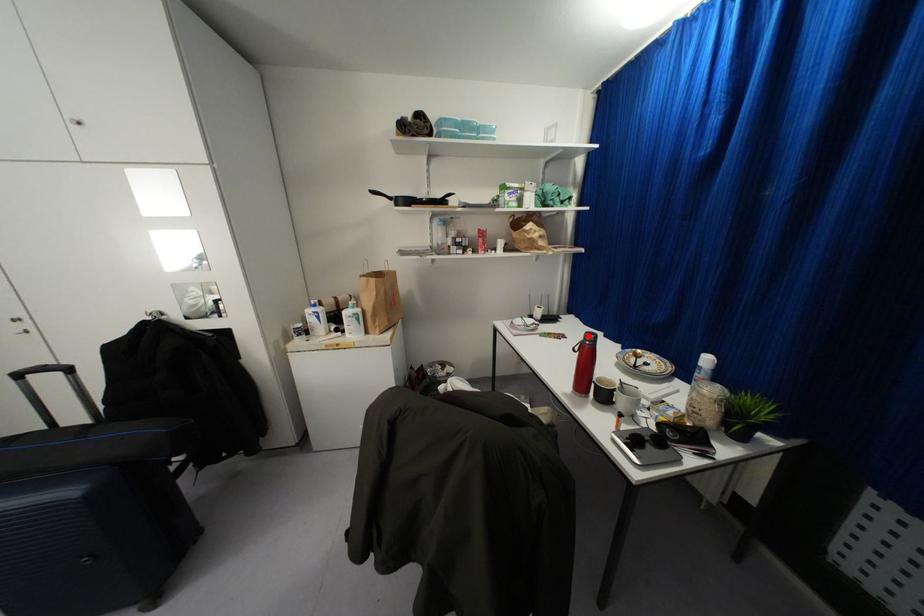
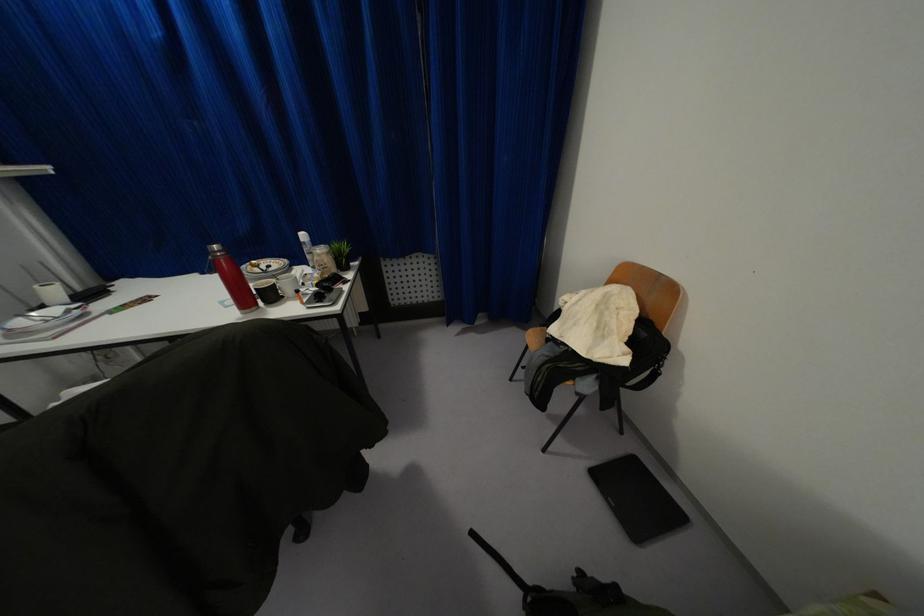
Question: I am providing you with two images of the same scene from different viewpoints. Given a red point in image1, look at the same physical point in image2. Is it:

Choices:
 (A) Closer to the viewpoint
 (B) Farther from the viewpoint

Answer: (B)